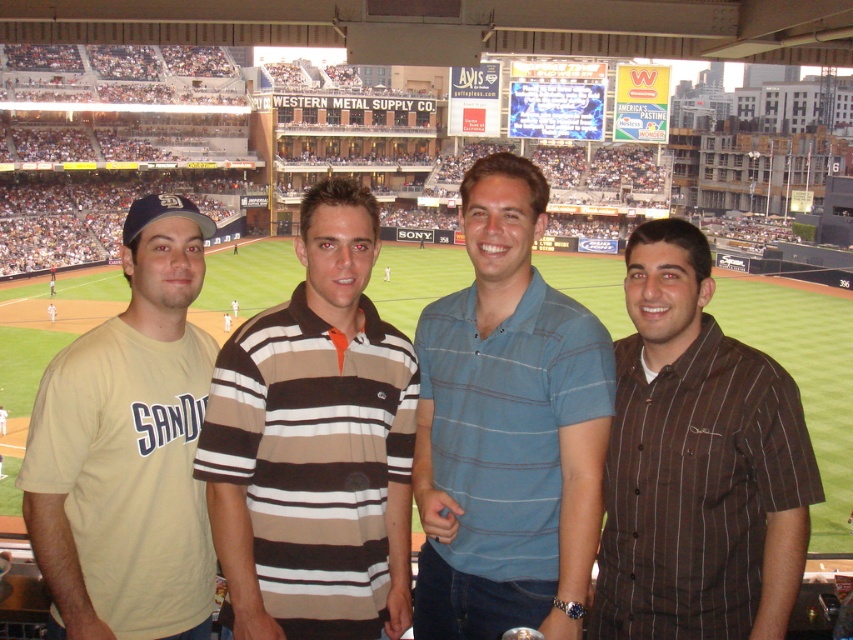
Question: Where is blue striped polo shirt at center located in relation to brown striped shirt at right in the image?

Choices:
 (A) right
 (B) left

Answer: (B)

Question: Which of the following is the closest to the observer?

Choices:
 (A) matte khaki t-shirt at left
 (B) blue striped polo shirt at center

Answer: (A)

Question: Is brown striped polo shirt at center above matte khaki t-shirt at left?

Choices:
 (A) yes
 (B) no

Answer: (A)

Question: Among these objects, which one is farthest from the camera?

Choices:
 (A) brown striped polo shirt at center
 (B) brown striped shirt at right
 (C) blue striped polo shirt at center
 (D) matte khaki t-shirt at left

Answer: (A)

Question: Can you confirm if brown striped polo shirt at center is positioned to the right of brown striped shirt at right?

Choices:
 (A) yes
 (B) no

Answer: (B)

Question: Which object is farther from the camera taking this photo?

Choices:
 (A) brown striped shirt at right
 (B) brown striped polo shirt at center
 (C) matte khaki t-shirt at left

Answer: (B)